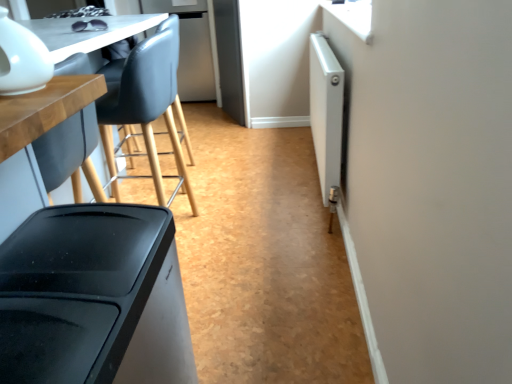
This screenshot has height=384, width=512. I want to click on free spot behind white metallic radiator at right, which is the 2th appliance from left to right, so click(271, 146).